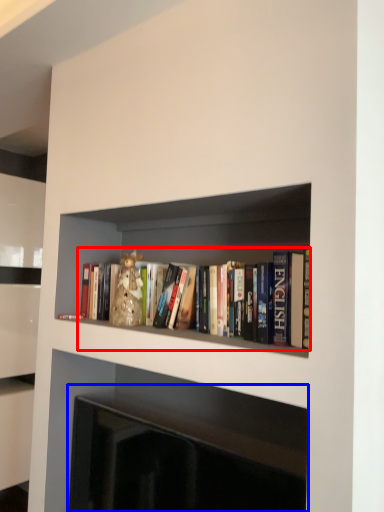
Question: Which object appears farthest to the camera in this image, book (highlighted by a red box) or fireplace (highlighted by a blue box)?

Choices:
 (A) book
 (B) fireplace

Answer: (A)